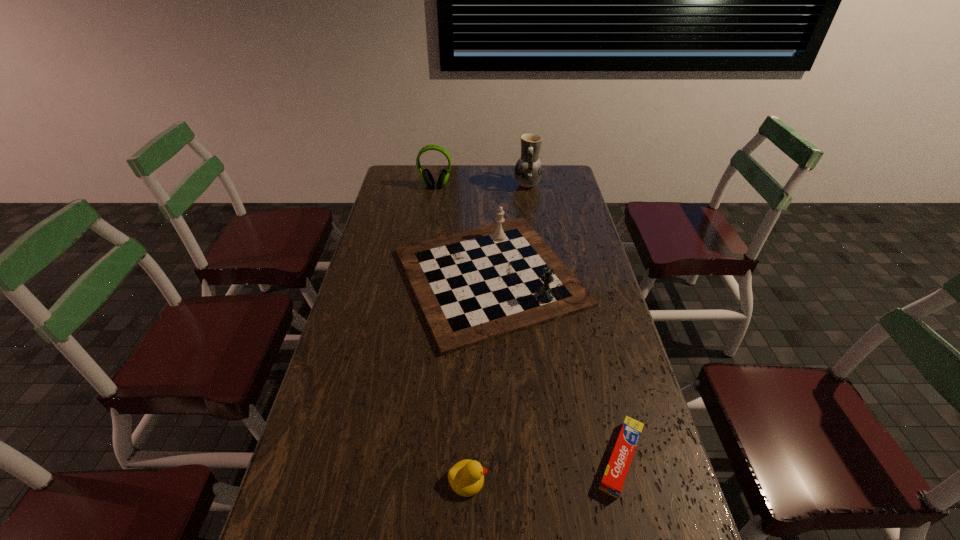
This screenshot has width=960, height=540. Identify the location of pottery. pyautogui.click(x=528, y=170).

Identify the location of the fourth shortest object. (427, 178).

Find the location of a particular element. Image resolution: width=960 pixels, height=540 pixels. gameboard is located at coordinates (475, 286).

I want to click on the third shortest object, so click(x=475, y=286).

Where is `the fourth tallest object`? The image size is (960, 540). the fourth tallest object is located at coordinates (466, 477).

The width and height of the screenshot is (960, 540). I want to click on the shortest object, so click(615, 474).

Locate an element on the screen. vacant region located 0.100m on either side of the tallest object is located at coordinates (492, 185).

Locate an element on the screen. vacant space located on either side of the tallest object is located at coordinates (492, 185).

What are the coordinates of `free location located on either side of the tallest object` in the screenshot? It's located at (460, 185).

Locate an element on the screen. The width and height of the screenshot is (960, 540). vacant region located on the front of the headset is located at coordinates (432, 211).